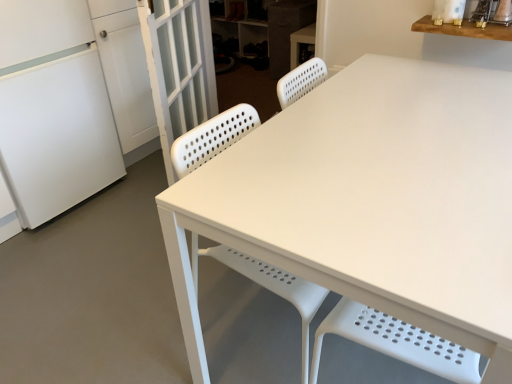
Describe the element at coordinates (464, 29) in the screenshot. I see `wooden shelf at upper right` at that location.

Where is `white matte cabinet at upper center, positioned as the 2th cabinetry in front-to-back order`? white matte cabinet at upper center, positioned as the 2th cabinetry in front-to-back order is located at coordinates (266, 28).

Locate an element on the screen. Image resolution: width=512 pixels, height=384 pixels. gray fabric cabinet at upper center, the first cabinetry viewed from the front is located at coordinates (286, 31).

I want to click on wooden shelf at upper right, so click(464, 29).

Identify the location of fridge that is on the left side of white matte cabinet at upper center, the 1th cabinetry in the back-to-front sequence. The width and height of the screenshot is (512, 384). (53, 109).

Consider the image. Based on their sizes in the image, would you say white matte refrigerator at left is bigger or smaller than white matte cabinet at upper center, the 1th cabinetry in the back-to-front sequence?

Considering their sizes, white matte refrigerator at left takes up more space than white matte cabinet at upper center, the 1th cabinetry in the back-to-front sequence.

Is point (24, 119) positioned behind point (274, 72)?

No, (24, 119) is in front of (274, 72).

Considering the sizes of objects white matte refrigerator at left and white matte cabinet at upper center, the 1th cabinetry in the back-to-front sequence, in the image provided, who is taller, white matte refrigerator at left or white matte cabinet at upper center, the 1th cabinetry in the back-to-front sequence,?

white matte refrigerator at left.

Does point (194, 239) come closer to viewer compared to point (176, 132)?

Yes, point (194, 239) is closer to viewer.

From the image's perspective, between white perforated plastic chair at center and white textured screen door at left, who is located below?

white perforated plastic chair at center.

Can you confirm if white perforated plastic chair at center is shorter than white textured screen door at left?

Indeed, white perforated plastic chair at center has a lesser height compared to white textured screen door at left.

From a real-world perspective, is white perforated plastic chair at center above or below white textured screen door at left?

From a real-world perspective, white perforated plastic chair at center is physically below white textured screen door at left.

Considering the relative positions of wooden shelf at upper right and white matte refrigerator at left in the image provided, is wooden shelf at upper right in front of white matte refrigerator at left?

Yes, it is.

Is wooden shelf at upper right next to white matte refrigerator at left?

No.

From a real-world perspective, is wooden shelf at upper right under white matte refrigerator at left?

No, from a real-world perspective, wooden shelf at upper right is not under white matte refrigerator at left.

Where is `fridge below the wooden shelf at upper right (from the image's perspective)`? This screenshot has height=384, width=512. fridge below the wooden shelf at upper right (from the image's perspective) is located at coordinates (53, 109).

From the picture: Does white textured screen door at left lie in front of white perforated plastic chair at center?

No, white textured screen door at left is further to the viewer.

Locate an element on the screen. Image resolution: width=512 pixels, height=384 pixels. chair below the white textured screen door at left (from a real-world perspective) is located at coordinates (269, 286).

Considering the sizes of white textured screen door at left and white perforated plastic chair at center in the image, is white textured screen door at left bigger or smaller than white perforated plastic chair at center?

Considering their sizes, white textured screen door at left takes up less space than white perforated plastic chair at center.

Is white textured screen door at left located outside white perforated plastic chair at center?

white textured screen door at left is positioned outside white perforated plastic chair at center.

Is gray fabric cabinet at upper center, the first cabinetry viewed from the front, oriented away from white textured screen door at left?

No.

Which is more to the left, gray fabric cabinet at upper center, the first cabinetry viewed from the front, or white textured screen door at left?

Positioned to the left is white textured screen door at left.

How much distance is there between gray fabric cabinet at upper center, the first cabinetry viewed from the front, and white textured screen door at left?

gray fabric cabinet at upper center, the first cabinetry viewed from the front, and white textured screen door at left are 1.25 meters apart.

From a real-world perspective, between white matte cabinet at upper center, positioned as the 2th cabinetry in front-to-back order, and gray fabric cabinet at upper center, which ranks as the 2th cabinetry in back-to-front order, who is vertically lower?

In real-world perspective, white matte cabinet at upper center, positioned as the 2th cabinetry in front-to-back order, is lower.

Is the position of white matte cabinet at upper center, positioned as the 2th cabinetry in front-to-back order, more distant than that of gray fabric cabinet at upper center, which ranks as the 2th cabinetry in back-to-front order?

Yes, it is.

Does white matte cabinet at upper center, positioned as the 2th cabinetry in front-to-back order, turn towards gray fabric cabinet at upper center, which ranks as the 2th cabinetry in back-to-front order?

No, white matte cabinet at upper center, positioned as the 2th cabinetry in front-to-back order, is not facing towards gray fabric cabinet at upper center, which ranks as the 2th cabinetry in back-to-front order.

Is white matte cabinet at upper center, positioned as the 2th cabinetry in front-to-back order, bigger or smaller than gray fabric cabinet at upper center, the first cabinetry viewed from the front?

Clearly, white matte cabinet at upper center, positioned as the 2th cabinetry in front-to-back order, is larger in size than gray fabric cabinet at upper center, the first cabinetry viewed from the front.

From a real-world perspective, which is physically below, white matte cabinet at upper center, the 1th cabinetry in the back-to-front sequence, or wooden shelf at upper right?

In real-world perspective, white matte cabinet at upper center, the 1th cabinetry in the back-to-front sequence, is lower.

From the image's perspective, which one is positioned higher, white matte cabinet at upper center, the 1th cabinetry in the back-to-front sequence, or wooden shelf at upper right?

white matte cabinet at upper center, the 1th cabinetry in the back-to-front sequence, from the image's perspective.

In terms of width, does white matte cabinet at upper center, positioned as the 2th cabinetry in front-to-back order, look wider or thinner when compared to wooden shelf at upper right?

white matte cabinet at upper center, positioned as the 2th cabinetry in front-to-back order, is wider than wooden shelf at upper right.

Is white matte cabinet at upper center, the 1th cabinetry in the back-to-front sequence, not inside wooden shelf at upper right?

That's correct, white matte cabinet at upper center, the 1th cabinetry in the back-to-front sequence, is outside of wooden shelf at upper right.

Locate an element on the screen. The width and height of the screenshot is (512, 384). fridge that is above the white matte cabinet at upper center, the 1th cabinetry in the back-to-front sequence (from a real-world perspective) is located at coordinates (53, 109).

I want to click on chair located below the white textured screen door at left (from the image's perspective), so click(x=269, y=286).

Estimate the real-world distances between objects in this image. Which object is further from white matte cabinet at upper center, the 1th cabinetry in the back-to-front sequence, wooden shelf at upper right or white matte refrigerator at left?

wooden shelf at upper right.

Estimate the real-world distances between objects in this image. Which object is further from white textured screen door at left, wooden shelf at upper right or white matte refrigerator at left?

wooden shelf at upper right.

Looking at the image, which one is located closer to white textured screen door at left, gray fabric cabinet at upper center, which ranks as the 2th cabinetry in back-to-front order, or wooden shelf at upper right?

Based on the image, wooden shelf at upper right appears to be nearer to white textured screen door at left.

Which object lies nearer to the anchor point white textured screen door at left, wooden shelf at upper right or white perforated plastic chair at center?

white perforated plastic chair at center is positioned closer to the anchor white textured screen door at left.

Estimate the real-world distances between objects in this image. Which object is further from white matte refrigerator at left, white matte cabinet at upper center, the 1th cabinetry in the back-to-front sequence, or gray fabric cabinet at upper center, the first cabinetry viewed from the front?

The object further to white matte refrigerator at left is white matte cabinet at upper center, the 1th cabinetry in the back-to-front sequence.

From the image, which object appears to be nearer to wooden shelf at upper right, white matte cabinet at upper center, positioned as the 2th cabinetry in front-to-back order, or white textured screen door at left?

The object closer to wooden shelf at upper right is white textured screen door at left.

Estimate the real-world distances between objects in this image. Which object is further from white perforated plastic chair at center, white matte cabinet at upper center, positioned as the 2th cabinetry in front-to-back order, or white textured screen door at left?

Among the two, white matte cabinet at upper center, positioned as the 2th cabinetry in front-to-back order, is located further to white perforated plastic chair at center.

Based on their spatial positions, is gray fabric cabinet at upper center, the first cabinetry viewed from the front, or white perforated plastic chair at center further from white matte refrigerator at left?

Among the two, gray fabric cabinet at upper center, the first cabinetry viewed from the front, is located further to white matte refrigerator at left.

You are a GUI agent. You are given a task and a screenshot of the screen. Output one action in this format:
    pyautogui.click(x=<x>, y=<y>)
    Task: Click on the counter top between white perforated plastic chair at center and gray fabric cabinet at upper center, the first cabinetry viewed from the front, along the z-axis
    This screenshot has width=512, height=384.
    Given the screenshot: What is the action you would take?
    pyautogui.click(x=464, y=29)

Where is `fridge between white perforated plastic chair at center and white matte cabinet at upper center, positioned as the 2th cabinetry in front-to-back order, in the front-back direction`? The height and width of the screenshot is (384, 512). fridge between white perforated plastic chair at center and white matte cabinet at upper center, positioned as the 2th cabinetry in front-to-back order, in the front-back direction is located at coordinates (53, 109).

Find the location of `screen door located between white matte refrigerator at left and gray fabric cabinet at upper center, which ranks as the 2th cabinetry in back-to-front order, in the depth direction`. screen door located between white matte refrigerator at left and gray fabric cabinet at upper center, which ranks as the 2th cabinetry in back-to-front order, in the depth direction is located at coordinates (179, 67).

Locate an element on the screen. The width and height of the screenshot is (512, 384). cabinetry positioned between white matte refrigerator at left and white matte cabinet at upper center, positioned as the 2th cabinetry in front-to-back order, from near to far is located at coordinates (286, 31).